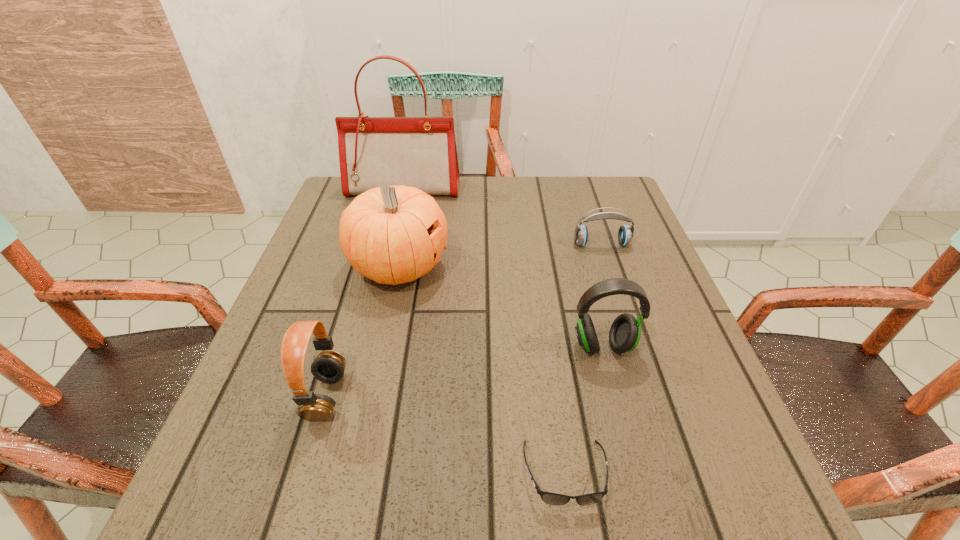
In order to click on free spot between the fourth farthest object and the shortest object in this screenshot , I will do `click(584, 409)`.

Locate an element on the screen. The width and height of the screenshot is (960, 540). unoccupied area between the leftmost headset and the tallest object is located at coordinates (365, 292).

The width and height of the screenshot is (960, 540). In order to click on vacant area that lies between the pumpkin and the sunglasses in this screenshot , I will do `click(482, 369)`.

Where is `vacant space that's between the handbag and the shortest headset`? This screenshot has width=960, height=540. vacant space that's between the handbag and the shortest headset is located at coordinates point(502,217).

At what (x,y) coordinates should I click in order to perform the action: click on vacant area that lies between the fifth shortest object and the second nearest headset. Please return your answer as a coordinate pair (x, y). The height and width of the screenshot is (540, 960). Looking at the image, I should click on (501, 306).

Find the location of a particular element. This screenshot has height=540, width=960. the second closest object relative to the fifth shortest object is located at coordinates (329, 366).

Identify which object is located as the third nearest to the farthest object. Please provide its 2D coordinates. Your answer should be formatted as a tuple, i.e. [(x, y)], where the tuple contains the x and y coordinates of a point satisfying the conditions above.

[(625, 332)]

Identify which headset is the third nearest to the handbag. Please provide its 2D coordinates. Your answer should be formatted as a tuple, i.e. [(x, y)], where the tuple contains the x and y coordinates of a point satisfying the conditions above.

[(329, 366)]

At what (x,y) coordinates should I click in order to perform the action: click on headset that stands as the closest to the pumpkin. Please return your answer as a coordinate pair (x, y). Image resolution: width=960 pixels, height=540 pixels. Looking at the image, I should click on point(329,366).

Where is `vacant space that satisfies the following two spatial constraints: 1. on the ear cups of the second shortest object; 2. on the ear cups of the leftmost headset`? The height and width of the screenshot is (540, 960). vacant space that satisfies the following two spatial constraints: 1. on the ear cups of the second shortest object; 2. on the ear cups of the leftmost headset is located at coordinates (652, 396).